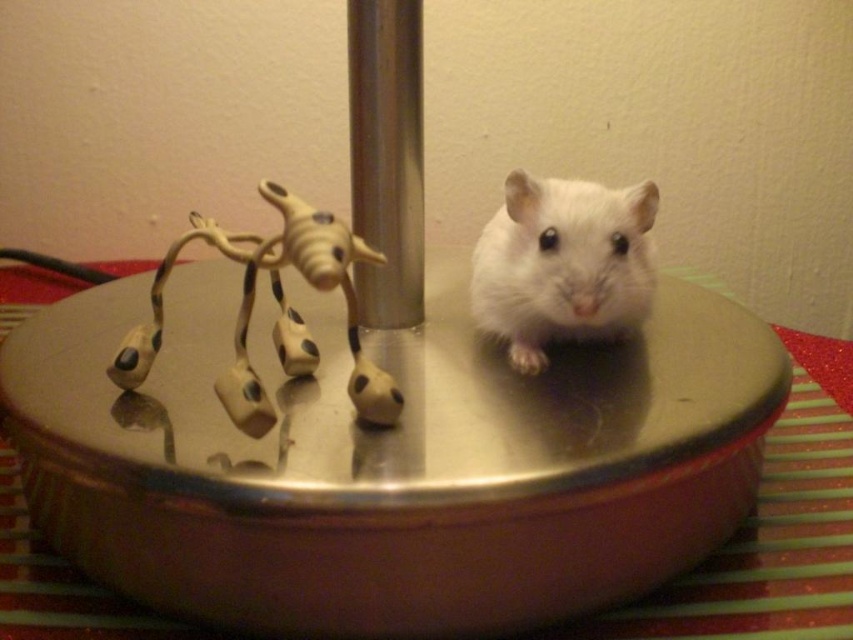
Which is more to the right, white fur hamster at center or silver metallic pole at center?

From the viewer's perspective, white fur hamster at center appears more on the right side.

Is white fur hamster at center wider than silver metallic pole at center?

Correct, the width of white fur hamster at center exceeds that of silver metallic pole at center.

You are a GUI agent. You are given a task and a screenshot of the screen. Output one action in this format:
    pyautogui.click(x=<x>, y=<y>)
    Task: Click on the white fur hamster at center
    The image size is (853, 640).
    Given the screenshot: What is the action you would take?
    pyautogui.click(x=561, y=262)

You are a GUI agent. You are given a task and a screenshot of the screen. Output one action in this format:
    pyautogui.click(x=<x>, y=<y>)
    Task: Click on the white fur hamster at center
    The image size is (853, 640).
    Given the screenshot: What is the action you would take?
    pyautogui.click(x=561, y=262)